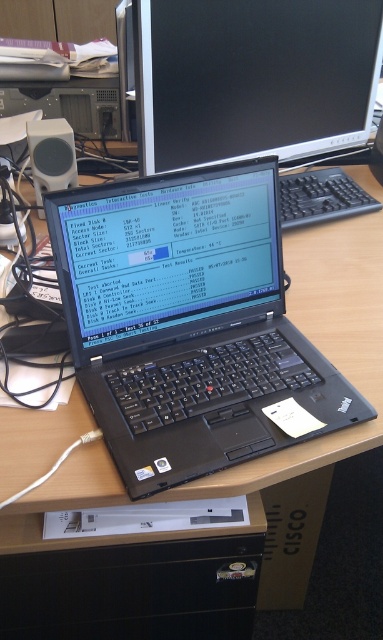
Identify the location of black matte laptop at center. This screenshot has width=383, height=640. (186, 323).

Does black matte laptop at center appear over black glossy monitor at upper center?

Incorrect, black matte laptop at center is not positioned above black glossy monitor at upper center.

This screenshot has width=383, height=640. Find the location of `black matte laptop at center`. black matte laptop at center is located at coordinates (186, 323).

Which of these two, black glossy monitor at upper center or black plastic keyboard at center, stands shorter?

With less height is black plastic keyboard at center.

Does black glossy monitor at upper center appear on the right side of black plastic keyboard at center?

No, black glossy monitor at upper center is not to the right of black plastic keyboard at center.

Where is `black glossy monitor at upper center`? The image size is (383, 640). black glossy monitor at upper center is located at coordinates (253, 77).

This screenshot has width=383, height=640. I want to click on black glossy monitor at upper center, so click(x=253, y=77).

Is the position of black matte laptop at center less distant than that of black plastic keyboard at center?

Yes.

Does black matte laptop at center appear under black plastic keyboard at center?

Correct, black matte laptop at center is located below black plastic keyboard at center.

Who is more forward, (x=85, y=230) or (x=286, y=218)?

Positioned in front is point (x=85, y=230).

Locate an element on the screen. The width and height of the screenshot is (383, 640). black matte laptop at center is located at coordinates (186, 323).